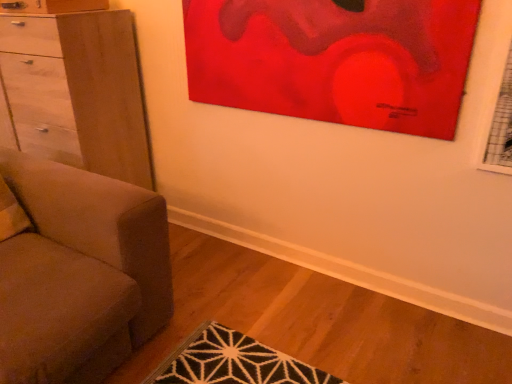
Image resolution: width=512 pixels, height=384 pixels. I want to click on matte red painting at upper center, so click(x=334, y=60).

Describe the element at coordinates (77, 271) in the screenshot. I see `matte gray couch at left` at that location.

This screenshot has width=512, height=384. What are the coordinates of `matte red painting at upper center` in the screenshot? It's located at (334, 60).

Locate an element on the screen. This screenshot has height=384, width=512. the chest of drawers that appears below the matte red painting at upper center (from a real-world perspective) is located at coordinates (78, 91).

Can you tell me how much light brown wood chest of drawers at left and matte red painting at upper center differ in facing direction?

There is a 0.416-degree angle between the facing directions of light brown wood chest of drawers at left and matte red painting at upper center.

Between light brown wood chest of drawers at left and matte red painting at upper center, which one is positioned in front?

matte red painting at upper center.

Is light brown wood chest of drawers at left bigger or smaller than matte red painting at upper center?

light brown wood chest of drawers at left is bigger than matte red painting at upper center.

Could you tell me if matte gray couch at left is facing light brown wood chest of drawers at left?

No, matte gray couch at left is not turned towards light brown wood chest of drawers at left.

Does matte gray couch at left lie in front of light brown wood chest of drawers at left?

Yes, it is in front of light brown wood chest of drawers at left.

Does matte gray couch at left have a larger size compared to light brown wood chest of drawers at left?

Indeed, matte gray couch at left has a larger size compared to light brown wood chest of drawers at left.

From a real-world perspective, does matte red painting at upper center sit lower than light brown wood chest of drawers at left?

Incorrect, from a real-world perspective, matte red painting at upper center is higher than light brown wood chest of drawers at left.

Who is taller, matte red painting at upper center or light brown wood chest of drawers at left?

Standing taller between the two is light brown wood chest of drawers at left.

Is matte red painting at upper center oriented away from light brown wood chest of drawers at left?

No, matte red painting at upper center is not facing the opposite direction of light brown wood chest of drawers at left.

Is matte red painting at upper center not within light brown wood chest of drawers at left?

matte red painting at upper center lies outside light brown wood chest of drawers at left's area.

Which is nearer, (145, 136) or (49, 359)?

Point (145, 136).

From the image's perspective, is light brown wood chest of drawers at left located above or below matte gray couch at left?

light brown wood chest of drawers at left is above matte gray couch at left.

Is light brown wood chest of drawers at left turned away from matte gray couch at left?

That's not correct — light brown wood chest of drawers at left is not looking away from matte gray couch at left.

In the scene shown: From a real-world perspective, is light brown wood chest of drawers at left positioned above or below matte gray couch at left?

light brown wood chest of drawers at left is situated higher than matte gray couch at left in the real world.

In the scene shown: Considering the relative sizes of matte red painting at upper center and matte gray couch at left in the image provided, is matte red painting at upper center thinner than matte gray couch at left?

Indeed, matte red painting at upper center has a lesser width compared to matte gray couch at left.

In the image, is matte red painting at upper center on the left side or the right side of matte gray couch at left?

Based on their positions, matte red painting at upper center is located to the right of matte gray couch at left.

From a real-world perspective, which is physically below, matte red painting at upper center or matte gray couch at left?

matte gray couch at left, from a real-world perspective.

Which is nearer, (333, 75) or (24, 213)?

Point (333, 75).

From the image's perspective, who appears lower, matte gray couch at left or matte red painting at upper center?

matte gray couch at left.

Which is correct: matte gray couch at left is inside matte red painting at upper center, or outside of it?

The correct answer is: outside.

Between matte gray couch at left and matte red painting at upper center, which one appears on the left side from the viewer's perspective?

From the viewer's perspective, matte gray couch at left appears more on the left side.

From a real-world perspective, does matte gray couch at left stand above matte red painting at upper center?

Incorrect, from a real-world perspective, matte gray couch at left is lower than matte red painting at upper center.

Where is `the chest of drawers that appears below the matte red painting at upper center (from the image's perspective)`? the chest of drawers that appears below the matte red painting at upper center (from the image's perspective) is located at coordinates (78, 91).

This screenshot has height=384, width=512. Find the location of `studio couch lying in front of the light brown wood chest of drawers at left`. studio couch lying in front of the light brown wood chest of drawers at left is located at coordinates (77, 271).

From the image, which object appears to be farther from matte red painting at upper center, light brown wood chest of drawers at left or matte gray couch at left?

matte gray couch at left.

Which object lies nearer to the anchor point matte gray couch at left, light brown wood chest of drawers at left or matte red painting at upper center?

Based on the image, light brown wood chest of drawers at left appears to be nearer to matte gray couch at left.

Consider the image. Considering their positions, is matte gray couch at left positioned closer to light brown wood chest of drawers at left than matte red painting at upper center?

matte gray couch at left lies closer to light brown wood chest of drawers at left than the other object.

Considering their positions, is matte red painting at upper center positioned further to matte gray couch at left than light brown wood chest of drawers at left?

matte red painting at upper center is further to matte gray couch at left.

Based on their spatial positions, is matte red painting at upper center or matte gray couch at left further from light brown wood chest of drawers at left?

matte red painting at upper center lies further to light brown wood chest of drawers at left than the other object.

Consider the image. Based on their spatial positions, is matte gray couch at left or light brown wood chest of drawers at left further from matte red painting at upper center?

matte gray couch at left is positioned further to the anchor matte red painting at upper center.

The width and height of the screenshot is (512, 384). What are the coordinates of `studio couch between light brown wood chest of drawers at left and matte red painting at upper center` in the screenshot? It's located at (77, 271).